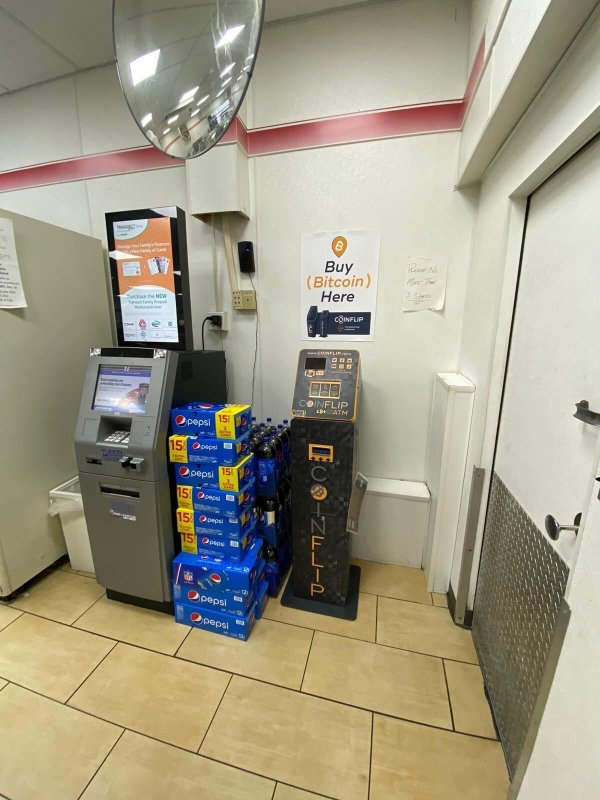
Image resolution: width=600 pixels, height=800 pixels. Find the location of `mirror`. mirror is located at coordinates (198, 61).